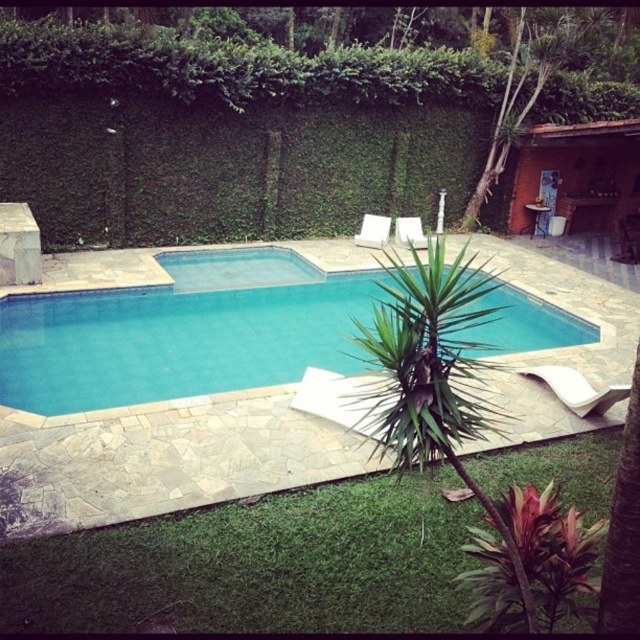
Question: Considering the relative positions of green leafy hedge at upper center and blue smooth pool at center in the image provided, where is green leafy hedge at upper center located with respect to blue smooth pool at center?

Choices:
 (A) right
 (B) left

Answer: (A)

Question: Is green leafy hedge at upper center positioned before blue smooth pool at center?

Choices:
 (A) no
 (B) yes

Answer: (A)

Question: Which of the following is the farthest from the observer?

Choices:
 (A) (3, 99)
 (B) (77, 410)

Answer: (A)

Question: Does green leafy hedge at upper center lie behind blue smooth pool at center?

Choices:
 (A) no
 (B) yes

Answer: (B)